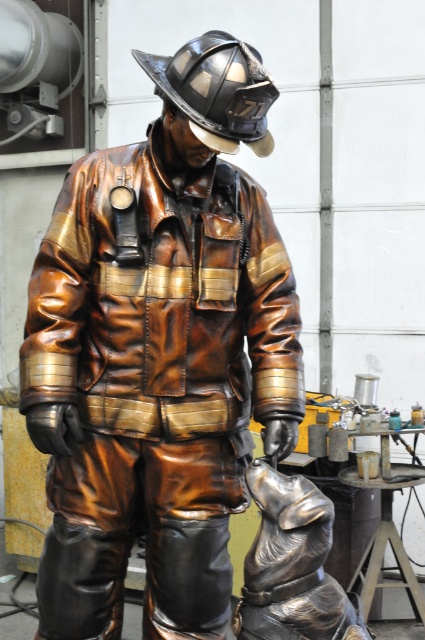
Which is above, shiny black helmet at center or shiny black boot at lower center?

shiny black helmet at center is above.

Which is in front, point (260, 116) or point (201, 600)?

Point (260, 116) is more forward.

Describe the element at coordinates (217, 90) in the screenshot. I see `shiny black helmet at center` at that location.

At what (x,y) coordinates should I click in order to perform the action: click on shiny black helmet at center. Please return your answer as a coordinate pair (x, y). The height and width of the screenshot is (640, 425). Looking at the image, I should click on (217, 90).

Does shiny black helmet at center appear over bronze/metallic boot at lower left?

Yes.

Which is in front, point (226, 36) or point (116, 552)?

Positioned in front is point (226, 36).

At what (x,y) coordinates should I click in order to perform the action: click on shiny black helmet at center. Please return your answer as a coordinate pair (x, y). Looking at the image, I should click on (217, 90).

Between bronze statue at center and shiny black boot at lower center, which one is positioned lower?

shiny black boot at lower center

Does point (59, 577) lie behind point (198, 614)?

No, it is not.

Locate an element on the screen. This screenshot has width=425, height=640. bronze statue at center is located at coordinates (159, 353).